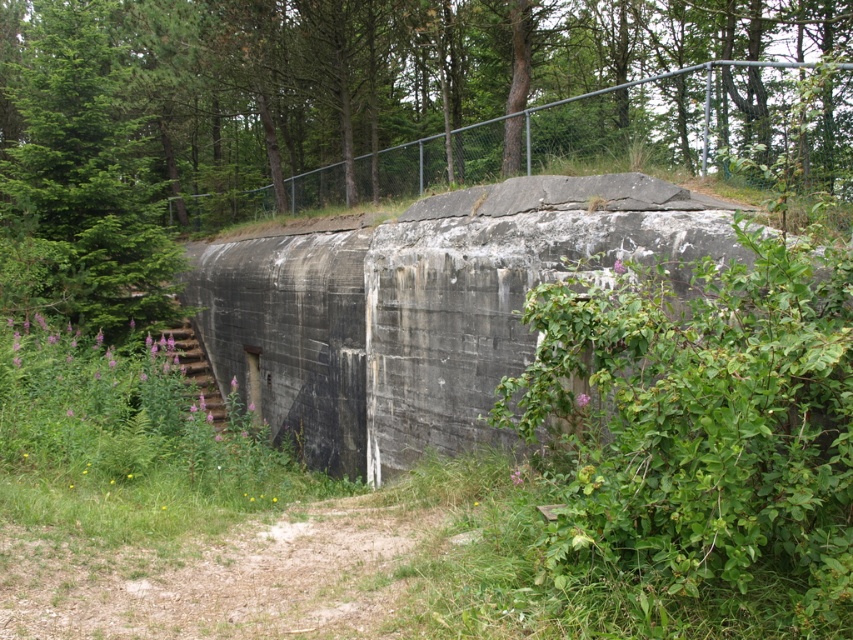
Consider the image. You are standing at the point marked by coordinates point (x=421, y=307) in the image. What is the object located directly beneath your feet?

The point (x=421, y=307) indicates gray concrete bunker at center, so the object directly beneath your feet is the gray concrete bunker at center.